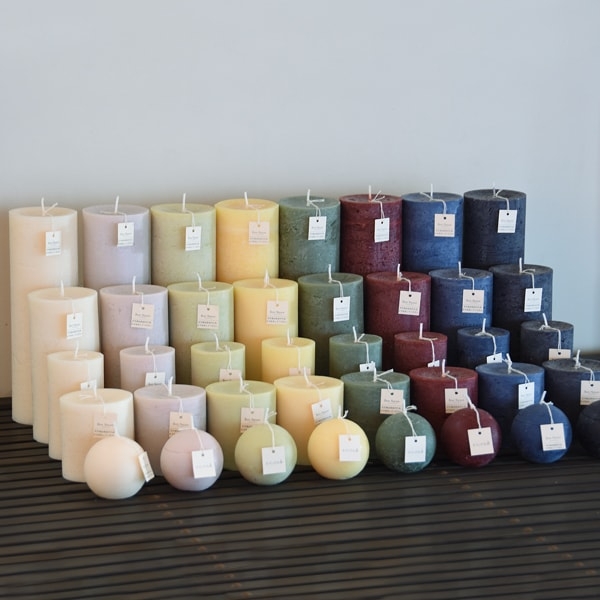
Find the location of a particular element. This screenshot has width=600, height=600. candles in back row is located at coordinates (33, 265), (100, 261), (172, 257), (237, 254), (301, 250), (368, 248), (424, 246), (482, 243).